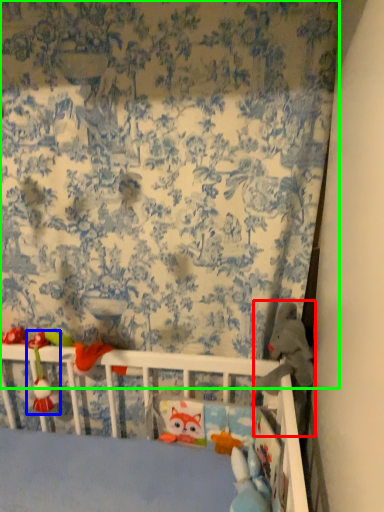
Question: Which object is positioned farthest from toy (highlighted by a red box)? Select from toy (highlighted by a blue box) and curtain (highlighted by a green box).

Choices:
 (A) toy
 (B) curtain

Answer: (A)